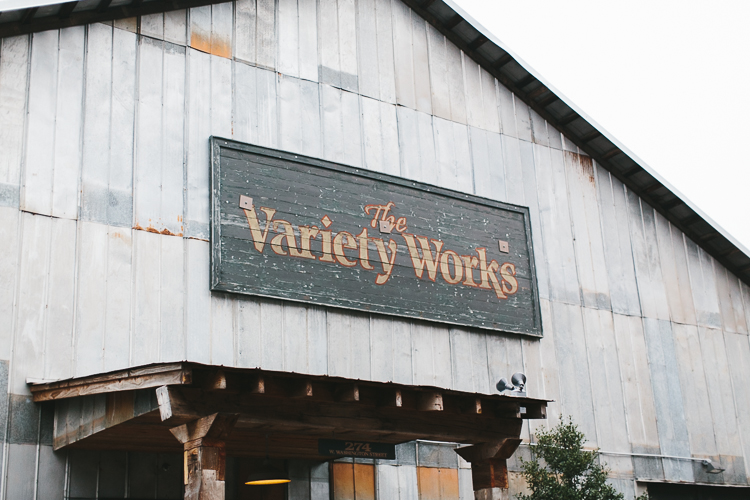
Locate an element on the screen. This screenshot has height=500, width=750. box is located at coordinates (519, 394).